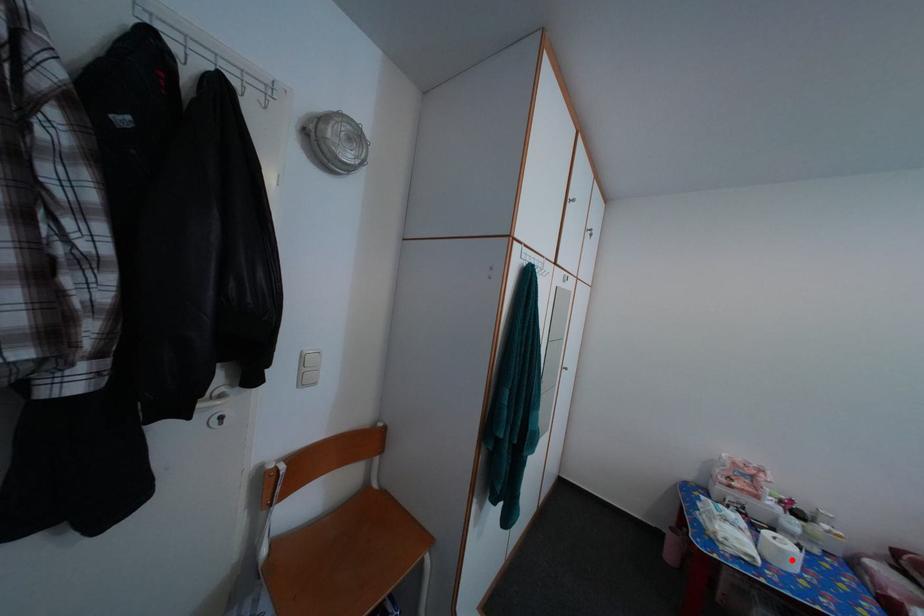
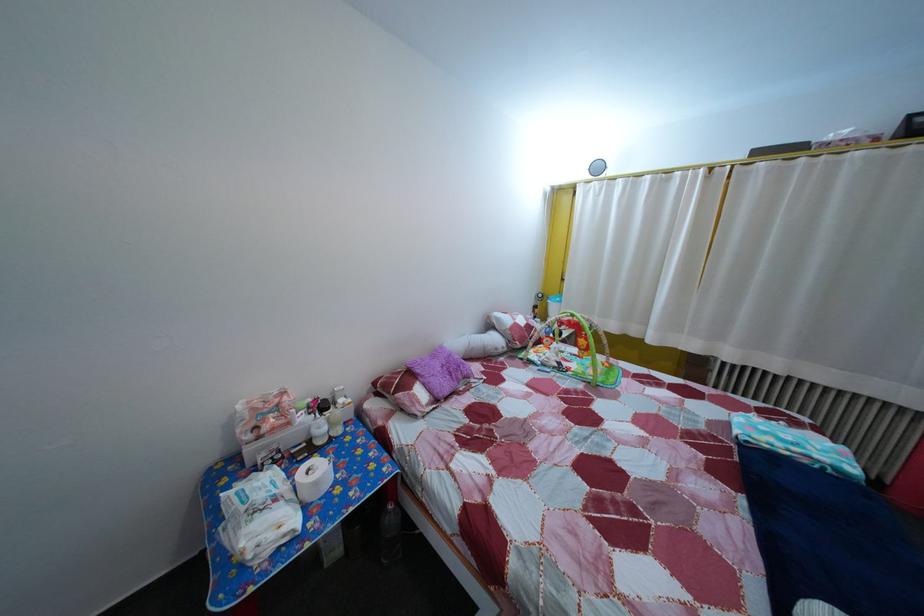
Where in the second image is the point corresponding to the highlighted location from the first image?

(325, 491)